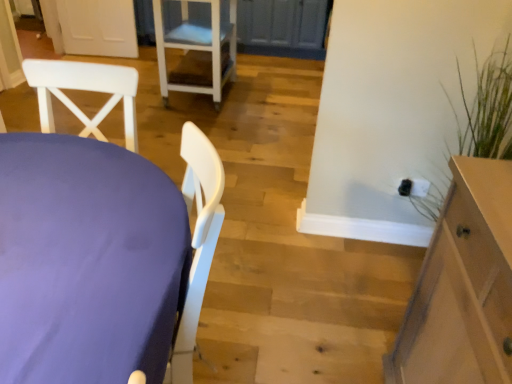
Question: Looking at their shapes, would you say purple fabric table at left is wider or thinner than light brown wood cabinet at right?

Choices:
 (A) wide
 (B) thin

Answer: (B)

Question: Does point (177, 198) appear closer or farther from the camera than point (478, 278)?

Choices:
 (A) farther
 (B) closer

Answer: (A)

Question: Which of these objects is positioned farthest from the light brown wood cabinet at right?

Choices:
 (A) white plastic chair at upper center
 (B) purple fabric table at left

Answer: (A)

Question: Which object is positioned closest to the white plastic chair at upper center?

Choices:
 (A) light brown wood cabinet at right
 (B) purple fabric table at left

Answer: (B)